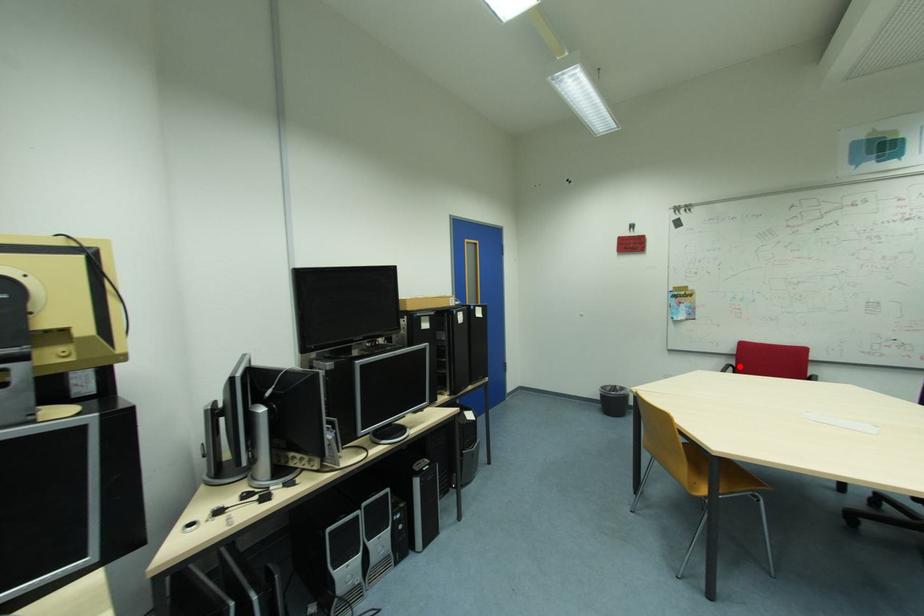
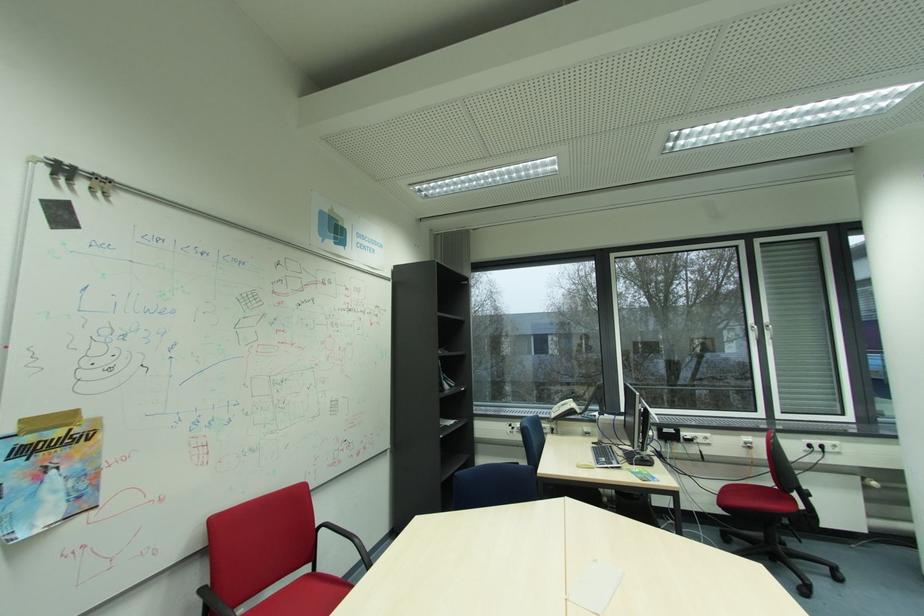
Where in the second image is the point corresponding to the highlighted location from the first image?

(212, 589)